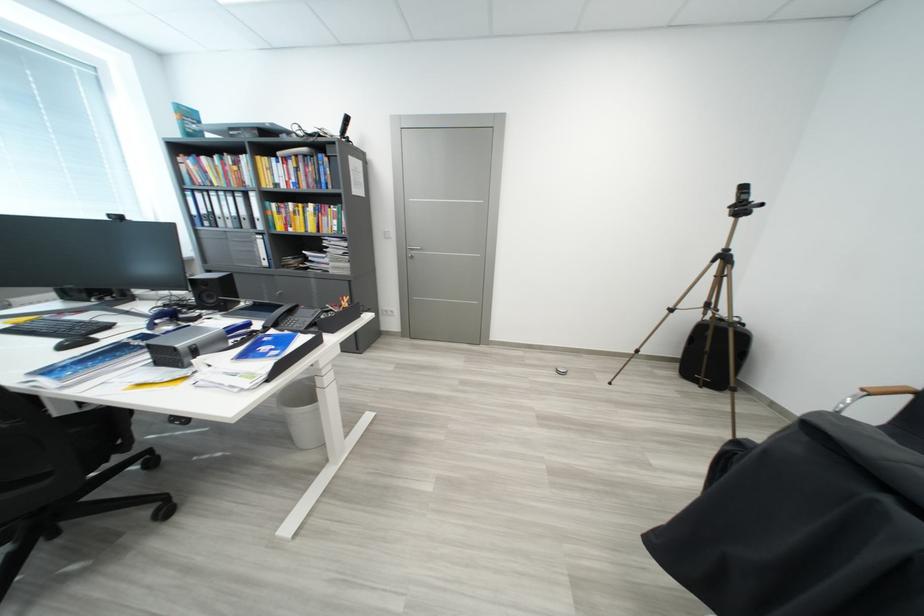
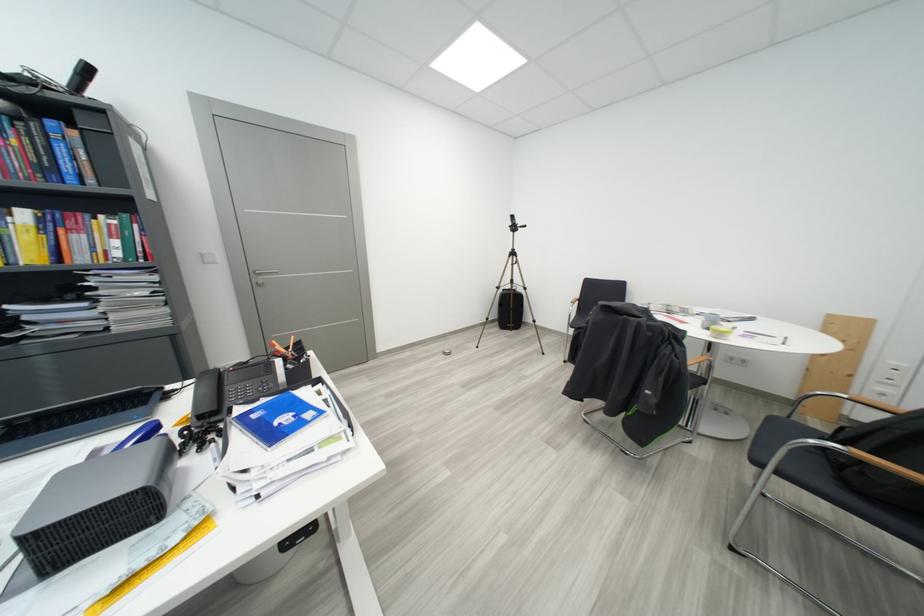
In the second image, find the point that corresponds to [321,208] in the first image.

(32, 216)